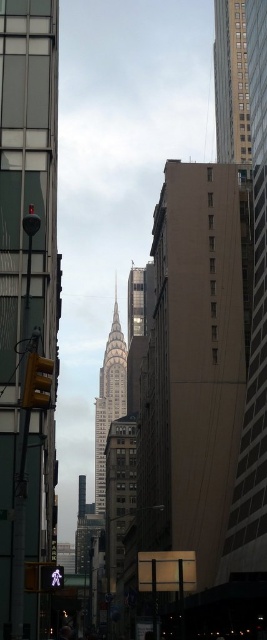
In the scene shown: You are standing on the street in front of the Chrysler Building and want to take a photo. There are two points of interest marked as point 1 at coordinates point (x=50, y=474) and point 2 at coordinates point (x=110, y=410). Which point should you focus on to ensure it appears larger in your camera view?

Point (x=50, y=474) should be focused on because it is closer to the camera and will appear larger in the photo compared to point (x=110, y=410).